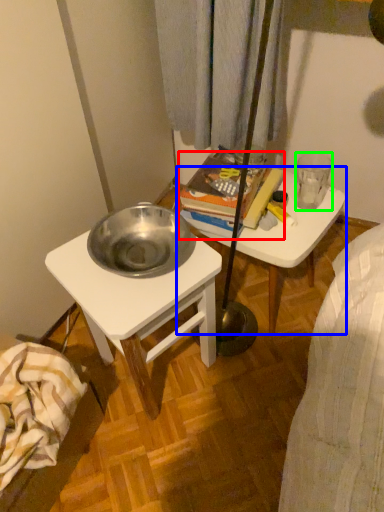
Question: Which object is positioned closest to book (highlighted by a red box)? Select from table (highlighted by a blue box) and coffee cup (highlighted by a green box).

Choices:
 (A) table
 (B) coffee cup

Answer: (A)